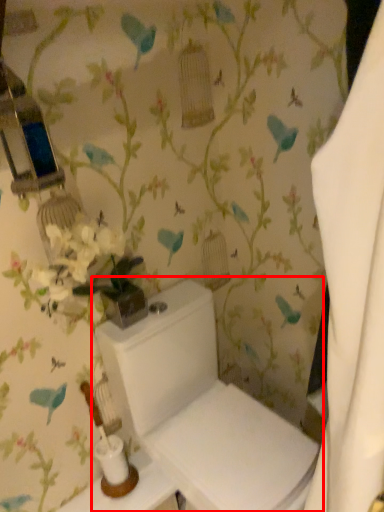
Question: From the image, what is the correct spatial relationship of toilet (annotated by the red box) in relation to table?

Choices:
 (A) right
 (B) left

Answer: (A)